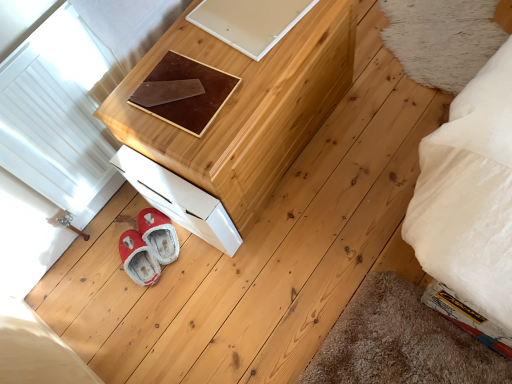
Question: From a real-world perspective, relative to fuzzy red slippers at lower left, is brown leather pad at center vertically above or below?

Choices:
 (A) above
 (B) below

Answer: (A)

Question: Is brown leather pad at center in front of or behind fuzzy red slippers at lower left in the image?

Choices:
 (A) front
 (B) behind

Answer: (A)

Question: Considering the real-world distances, which object is closest to the natural wood chest of drawers at upper center?

Choices:
 (A) white glossy drawer at lower left
 (B) brown leather pad at center
 (C) fuzzy red slippers at lower left

Answer: (B)

Question: Which is farther from the fuzzy red slippers at lower left?

Choices:
 (A) white glossy drawer at lower left
 (B) natural wood chest of drawers at upper center
 (C) brown leather pad at center

Answer: (C)